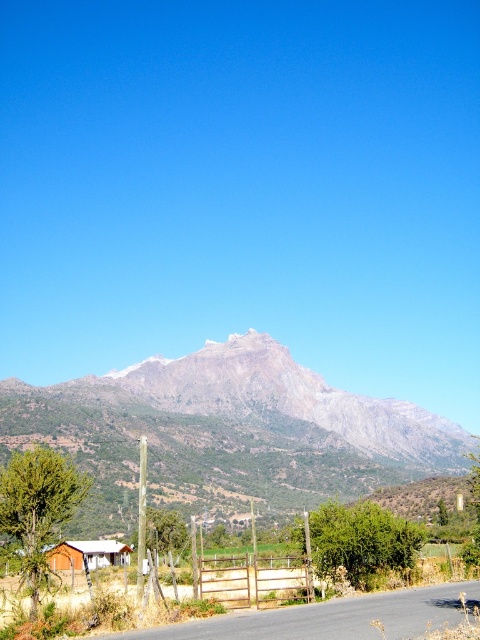
You are standing at the wooden cabin at lower left and want to take a photo of the gray rocky mountain range at upper center. In which direction should you point your camera to capture the mountain in the frame?

You should point your camera to the right of the wooden cabin at lower left because the gray rocky mountain range at upper center is located to the right of it.

You are standing at the bottom right corner of the image where the paved road is. You want to walk directly towards the gray rocky mountain range at upper center. Which direction should you walk?

You should walk towards the upper center direction to reach the gray rocky mountain range at upper center since it is located at point (x=227, y=433) in the image.

You are standing at the wooden cabin at lower left and want to take a photo of the gray rocky mountain range at upper center. Is the mountain range visible from your current position?

The gray rocky mountain range at upper center is below the wooden cabin at lower left, which means the mountain range is positioned lower in the frame than the cabin. Since the cabin is at a lower position, the mountain range would be behind and above it, making it visible for photography.